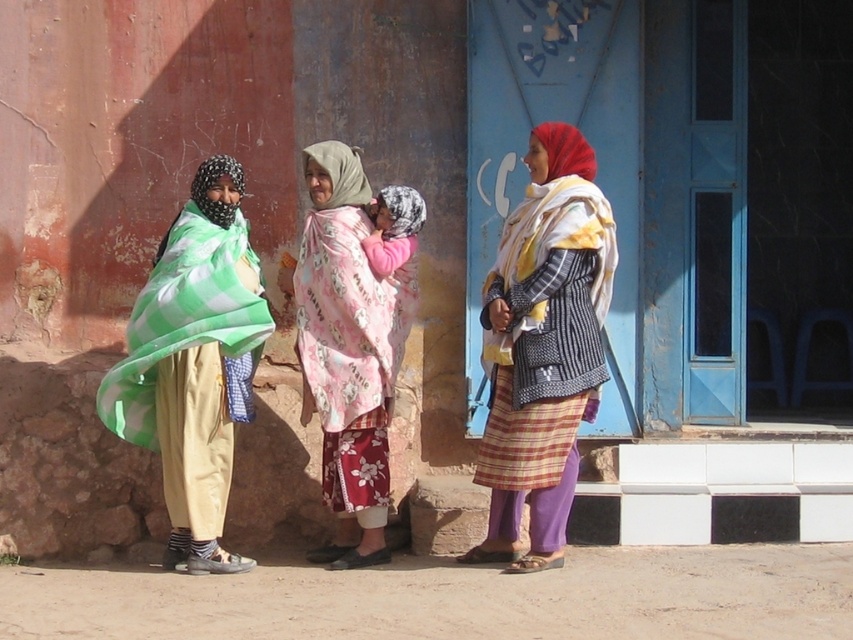
You are a photographer trying to capture a group photo of the women. You want to ensure that both the green checkered scarf at left and the pink floral scarf at center are in focus. Given that your camera has a depth of field that can cover 20 inches, will you need to adjust your settings to include both scarves?

The distance between the green checkered scarf at left and the pink floral scarf at center is 22.00 inches. Since the depth of field can only cover 20 inches, you will need to adjust your camera settings to ensure both scarves are in focus.

Consider the image. You are a fashion designer observing the two central items in the image. Which item, the striped woolen sweater at center or the pink floral scarf at center, would you estimate has a greater horizontal width when laid flat?

The striped woolen sweater at center is wider than the pink floral scarf at center according to the description.

You are a photographer trying to capture a group photo of the green checkered scarf at left and the pink floral scarf at center. From the photographer perspective, which scarf should be positioned to the right side of the frame to ensure both are visible?

The pink floral scarf at center should be positioned to the right side of the frame because the green checkered scarf at left is already to the left of it, so moving the pink floral scarf further right will keep both within the frame.